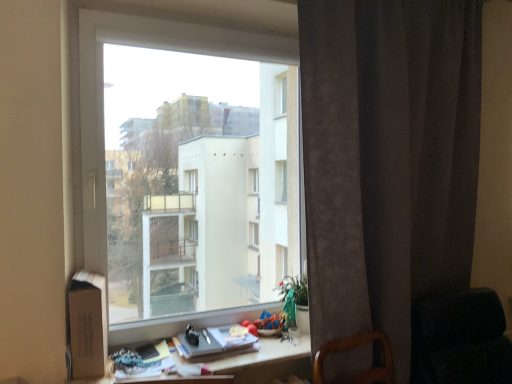
Question: Is transparent glass window at center not inside dark gray velvet curtain at right?

Choices:
 (A) yes
 (B) no

Answer: (A)

Question: Is transparent glass window at center aimed at dark gray velvet curtain at right?

Choices:
 (A) yes
 (B) no

Answer: (B)

Question: Is transparent glass window at center positioned far away from dark gray velvet curtain at right?

Choices:
 (A) no
 (B) yes

Answer: (A)

Question: From a real-world perspective, does transparent glass window at center sit lower than dark gray velvet curtain at right?

Choices:
 (A) no
 (B) yes

Answer: (A)

Question: From the image's perspective, is transparent glass window at center over dark gray velvet curtain at right?

Choices:
 (A) yes
 (B) no

Answer: (A)

Question: Is transparent glass window at center to the left or to the right of dark fabric rocking chair at lower right in the image?

Choices:
 (A) left
 (B) right

Answer: (A)

Question: Is transparent glass window at center bigger or smaller than dark fabric rocking chair at lower right?

Choices:
 (A) small
 (B) big

Answer: (B)

Question: Is transparent glass window at center in front of or behind dark fabric rocking chair at lower right in the image?

Choices:
 (A) behind
 (B) front

Answer: (A)

Question: Looking at their shapes, would you say transparent glass window at center is wider or thinner than dark fabric rocking chair at lower right?

Choices:
 (A) thin
 (B) wide

Answer: (A)

Question: Looking at their shapes, would you say dark gray velvet curtain at right is wider or thinner than matte gray book at lower center?

Choices:
 (A) thin
 (B) wide

Answer: (B)

Question: From the image's perspective, is dark gray velvet curtain at right above or below matte gray book at lower center?

Choices:
 (A) above
 (B) below

Answer: (A)

Question: In terms of height, does dark gray velvet curtain at right look taller or shorter compared to matte gray book at lower center?

Choices:
 (A) short
 (B) tall

Answer: (B)

Question: Considering their positions, is dark gray velvet curtain at right located in front of or behind matte gray book at lower center?

Choices:
 (A) behind
 (B) front

Answer: (B)

Question: Relative to dark fabric rocking chair at lower right, is wooden desk at center in front or behind?

Choices:
 (A) front
 (B) behind

Answer: (A)

Question: From the image's perspective, relative to dark fabric rocking chair at lower right, is wooden desk at center above or below?

Choices:
 (A) below
 (B) above

Answer: (B)